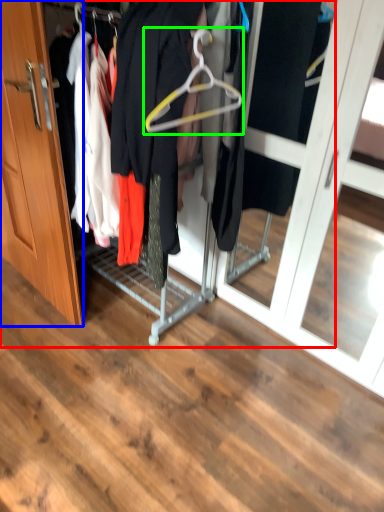
Question: Which object is positioned farthest from closet (highlighted by a red box)? Select from door (highlighted by a blue box) and hanger (highlighted by a green box).

Choices:
 (A) door
 (B) hanger

Answer: (B)